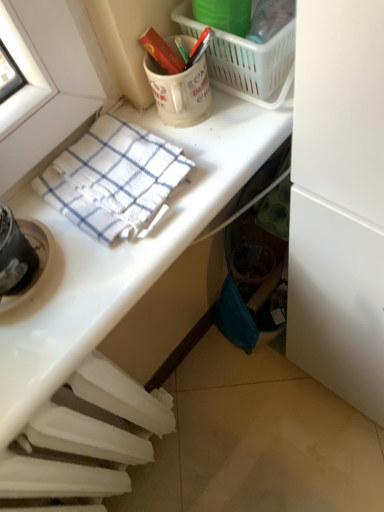
Measure the distance between white plastic radiator at lower left and camera.

19.61 inches.

Locate an element on the screen. white plastic picnic basket at upper center is located at coordinates (253, 66).

Describe the element at coordinates (180, 92) in the screenshot. The width and height of the screenshot is (384, 512). I see `white matte coffee cup at upper center` at that location.

Where is `green plastic bucket at upper center`? This screenshot has width=384, height=512. green plastic bucket at upper center is located at coordinates (224, 15).

Image resolution: width=384 pixels, height=512 pixels. I want to click on white plastic radiator at lower left, so click(84, 441).

Is white plastic picnic basket at upper center next to white matte coffee cup at upper center and touching it?

Yes.

Considering the sizes of objects white plastic picnic basket at upper center and white matte coffee cup at upper center in the image provided, who is bigger, white plastic picnic basket at upper center or white matte coffee cup at upper center?

Bigger between the two is white plastic picnic basket at upper center.

Considering the positions of points (258, 60) and (168, 94), is point (258, 60) closer to camera compared to point (168, 94)?

Yes, point (258, 60) is closer to viewer.

Could you tell me if white plastic picnic basket at upper center is turned towards white matte coffee cup at upper center?

No, white plastic picnic basket at upper center is not turned towards white matte coffee cup at upper center.

Does white checkered towel at upper left have a smaller size compared to white plastic picnic basket at upper center?

Yes.

Is white checkered towel at upper left turned away from white plastic picnic basket at upper center?

No, white checkered towel at upper left is not facing away from white plastic picnic basket at upper center.

Does point (86, 182) come farther from viewer compared to point (277, 106)?

No.

Locate an element on the screen. Image resolution: width=384 pixels, height=512 pixels. picnic basket lying on the right of white checkered towel at upper left is located at coordinates (253, 66).

From a real-world perspective, between white glossy towel at upper left and white plastic radiator at lower left, who is vertically higher?

white glossy towel at upper left is physically above.

Is point (140, 443) more distant than point (81, 441)?

Yes, point (140, 443) is behind point (81, 441).

Is white glossy towel at upper left beside white plastic radiator at lower left?

Yes, the surface of white glossy towel at upper left is in contact with white plastic radiator at lower left.

Does white glossy towel at upper left have a lesser height compared to white plastic picnic basket at upper center?

Indeed, white glossy towel at upper left has a lesser height compared to white plastic picnic basket at upper center.

From a real-world perspective, which is physically below, white glossy towel at upper left or white plastic picnic basket at upper center?

white glossy towel at upper left, from a real-world perspective.

Locate an element on the screen. picnic basket above the white glossy towel at upper left (from a real-world perspective) is located at coordinates (253, 66).

Is point (177, 136) positioned before point (260, 51)?

No.

Is white plastic picnic basket at upper center oriented towards white plastic radiator at lower left?

No, white plastic picnic basket at upper center is not oriented towards white plastic radiator at lower left.

Between point (277, 93) and point (26, 445), which one is positioned in front?

Point (26, 445)

Which object is further away from the camera taking this photo, white plastic picnic basket at upper center or white plastic radiator at lower left?

Positioned behind is white plastic picnic basket at upper center.

Can you confirm if white plastic picnic basket at upper center is taller than white plastic radiator at lower left?

No.

From the picture: From the image's perspective, does white plastic picnic basket at upper center appear lower than white checkered towel at upper left?

No, from the image's perspective, white plastic picnic basket at upper center is not beneath white checkered towel at upper left.

Measure the distance from white plastic picnic basket at upper center to white checkered towel at upper left.

A distance of 7.28 inches exists between white plastic picnic basket at upper center and white checkered towel at upper left.

Locate an element on the screen. towel/napkin that is under the white plastic picnic basket at upper center (from a real-world perspective) is located at coordinates (113, 178).

Between white plastic picnic basket at upper center and white checkered towel at upper left, which one is positioned behind?

white plastic picnic basket at upper center is further from the camera.

Does white glossy towel at upper left have a larger size compared to green plastic bucket at upper center?

Indeed, white glossy towel at upper left has a larger size compared to green plastic bucket at upper center.

Does white glossy towel at upper left contain green plastic bucket at upper center?

No, white glossy towel at upper left does not contain green plastic bucket at upper center.

From a real-world perspective, is white glossy towel at upper left on green plastic bucket at upper center?

No, from a real-world perspective, white glossy towel at upper left is not over green plastic bucket at upper center

Relative to green plastic bucket at upper center, is white glossy towel at upper left in front or behind?

white glossy towel at upper left is positioned closer to the viewer than green plastic bucket at upper center.

Find the location of `picnic basket below the white matte coffee cup at upper center (from a real-world perspective)`. picnic basket below the white matte coffee cup at upper center (from a real-world perspective) is located at coordinates (253, 66).

Where is `towel/napkin that is below the white plastic picnic basket at upper center (from the image's perspective)`? towel/napkin that is below the white plastic picnic basket at upper center (from the image's perspective) is located at coordinates (113, 178).

Looking at the image, which one is located further to green plastic bucket at upper center, white glossy towel at upper left or white checkered towel at upper left?

white glossy towel at upper left is positioned further to the anchor green plastic bucket at upper center.

When comparing their distances from green plastic bucket at upper center, does white plastic picnic basket at upper center or white glossy towel at upper left seem further?

Based on the image, white glossy towel at upper left appears to be further to green plastic bucket at upper center.

From the picture: From the image, which object appears to be nearer to green plastic bucket at upper center, white matte coffee cup at upper center or white glossy towel at upper left?

white matte coffee cup at upper center.

Based on their spatial positions, is white matte coffee cup at upper center or green plastic bucket at upper center further from white plastic radiator at lower left?

green plastic bucket at upper center is further to white plastic radiator at lower left.

Considering their positions, is white checkered towel at upper left positioned further to white plastic picnic basket at upper center than green plastic bucket at upper center?

white checkered towel at upper left lies further to white plastic picnic basket at upper center than the other object.

Considering their positions, is white plastic picnic basket at upper center positioned further to white glossy towel at upper left than white matte coffee cup at upper center?

white plastic picnic basket at upper center.

Considering their positions, is white glossy towel at upper left positioned closer to white plastic radiator at lower left than white matte coffee cup at upper center?

white glossy towel at upper left.

Considering their positions, is white matte coffee cup at upper center positioned closer to white checkered towel at upper left than white plastic radiator at lower left?

white matte coffee cup at upper center.

The width and height of the screenshot is (384, 512). Find the location of `desk that lies between white checkered towel at upper left and white plastic radiator at lower left from top to bottom`. desk that lies between white checkered towel at upper left and white plastic radiator at lower left from top to bottom is located at coordinates (108, 321).

Image resolution: width=384 pixels, height=512 pixels. I want to click on towel/napkin between green plastic bucket at upper center and white plastic radiator at lower left in the vertical direction, so click(113, 178).

This screenshot has height=512, width=384. I want to click on coffee cup between white plastic picnic basket at upper center and white glossy towel at upper left vertically, so click(180, 92).

Where is `picnic basket between green plastic bucket at upper center and white checkered towel at upper left in the vertical direction`? The image size is (384, 512). picnic basket between green plastic bucket at upper center and white checkered towel at upper left in the vertical direction is located at coordinates (253, 66).